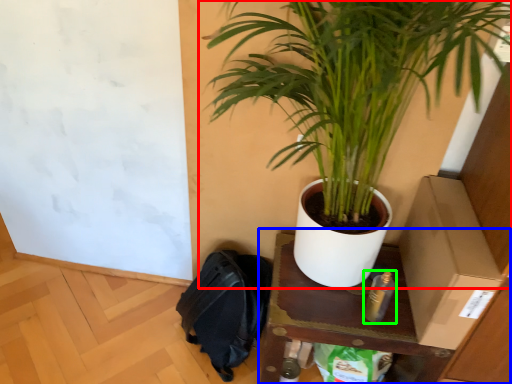
Question: Which is farther away from houseplant (highlighted by a red box)? table (highlighted by a blue box) or bottle (highlighted by a green box)?

Choices:
 (A) table
 (B) bottle

Answer: (B)